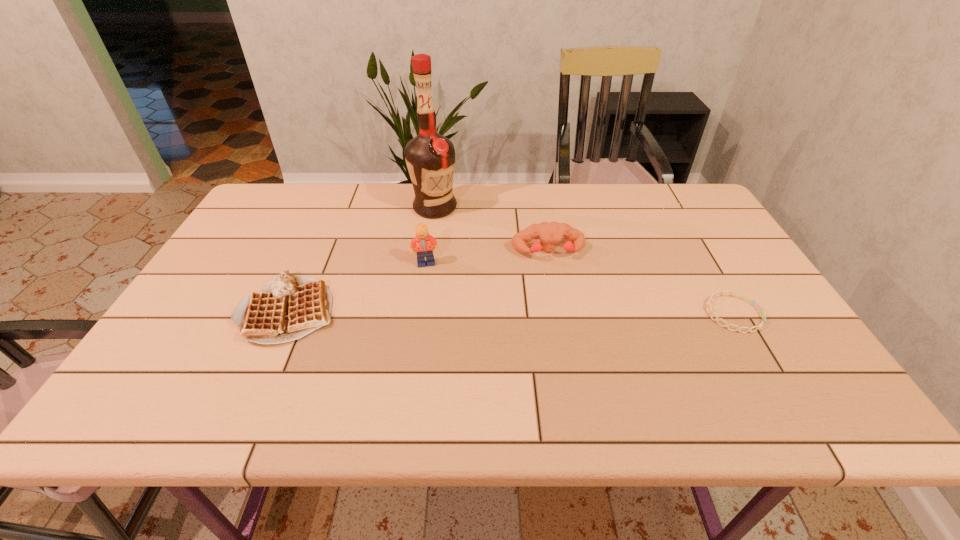
Locate which object is the fourth closest to the fourth object from left to right. Please provide its 2D coordinates. Your answer should be formatted as a tuple, i.e. [(x, y)], where the tuple contains the x and y coordinates of a point satisfying the conditions above.

[(289, 307)]

What are the coordinates of `vacant position in the image that satisfies the following two spatial constraints: 1. on the back side of the waffle; 2. on the right side of the Lego` in the screenshot? It's located at (309, 264).

You are a GUI agent. You are given a task and a screenshot of the screen. Output one action in this format:
    pyautogui.click(x=<x>, y=<y>)
    Task: Click on the free space that satisfies the following two spatial constraints: 1. on the front side of the bracelet; 2. on the surface of the liquor showing star-shaped elements
    Image resolution: width=960 pixels, height=540 pixels.
    Given the screenshot: What is the action you would take?
    pyautogui.click(x=420, y=314)

Locate an element on the screen. The height and width of the screenshot is (540, 960). blank space that satisfies the following two spatial constraints: 1. on the back side of the second tallest object; 2. on the right side of the waffle is located at coordinates (309, 264).

Find the location of a particular element. The image size is (960, 540). vacant space that satisfies the following two spatial constraints: 1. on the back side of the fourth object from left to right; 2. on the left side of the fourth shortest object is located at coordinates (427, 252).

Locate an element on the screen. This screenshot has height=540, width=960. vacant position in the image that satisfies the following two spatial constraints: 1. on the front side of the fourth object from left to right; 2. on the surface of the shortest object showing star-shaped elements is located at coordinates (560, 314).

At what (x,y) coordinates should I click in order to perform the action: click on vacant region that satisfies the following two spatial constraints: 1. on the back side of the tallest object; 2. on the right side of the leftmost object. Please return your answer as a coordinate pair (x, y). Looking at the image, I should click on (334, 208).